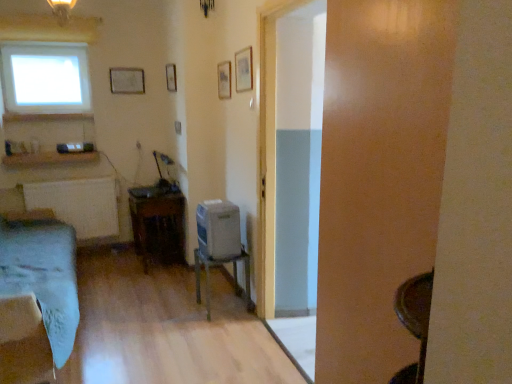
What is the approximate width of wooden table at center, which ranks as the second table in right-to-left order?

It is 17.06 inches.

Locate an element on the screen. white matte radiator at left is located at coordinates (78, 204).

This screenshot has height=384, width=512. Describe the element at coordinates (170, 77) in the screenshot. I see `wooden picture frame at upper center, the 3th picture frame in the right-to-left sequence` at that location.

Image resolution: width=512 pixels, height=384 pixels. What do you see at coordinates (244, 70) in the screenshot? I see `wooden picture frame at upper center, marked as the 4th picture frame in a back-to-front arrangement` at bounding box center [244, 70].

This screenshot has width=512, height=384. Identify the location of light blue fabric bed at left. (42, 276).

Locate an element on the screen. metallic gray table at center, which is the 1th table in right-to-left order is located at coordinates (233, 277).

Is transparent glass window at upper left turned away from satin silver desktop at center?

transparent glass window at upper left is not turned away from satin silver desktop at center.

From the image's perspective, between transparent glass window at upper left and satin silver desktop at center, which one is located above?

transparent glass window at upper left is shown above in the image.

From the picture: Considering the sizes of transparent glass window at upper left and satin silver desktop at center in the image, is transparent glass window at upper left taller or shorter than satin silver desktop at center?

In the image, transparent glass window at upper left appears to be taller than satin silver desktop at center.

Is transparent glass window at upper left with satin silver desktop at center?

No, transparent glass window at upper left is not touching satin silver desktop at center.

Which of these two, wooden table at center, which ranks as the second table in right-to-left order, or wooden picture frame at upper center, which ranks as the second picture frame in left-to-right order, is smaller?

Smaller between the two is wooden picture frame at upper center, which ranks as the second picture frame in left-to-right order.

From a real-world perspective, relative to wooden picture frame at upper center, the 3th picture frame in the front-to-back sequence, is wooden table at center, which ranks as the second table in right-to-left order, vertically above or below?

Clearly, from a real-world perspective, wooden table at center, which ranks as the second table in right-to-left order, is below wooden picture frame at upper center, the 3th picture frame in the front-to-back sequence.

Based on the photo, is wooden table at center, the 1th table from the back, closer to the viewer compared to wooden picture frame at upper center, the 3th picture frame in the front-to-back sequence?

Yes, wooden table at center, the 1th table from the back, is in front of wooden picture frame at upper center, the 3th picture frame in the front-to-back sequence.

You are a GUI agent. You are given a task and a screenshot of the screen. Output one action in this format:
    pyautogui.click(x=<x>, y=<y>)
    Task: Click on the radiator behind the matte wooden picture frame at upper center, marked as the second picture frame in a right-to-left arrangement
    This screenshot has height=384, width=512.
    Given the screenshot: What is the action you would take?
    pyautogui.click(x=78, y=204)

Which object is thinner, matte wooden picture frame at upper center, which appears as the third picture frame when viewed from the back, or white matte radiator at left?

Thinner between the two is matte wooden picture frame at upper center, which appears as the third picture frame when viewed from the back.

From a real-world perspective, is matte wooden picture frame at upper center, which appears as the third picture frame when viewed from the back, physically located above or below white matte radiator at left?

From a real-world perspective, matte wooden picture frame at upper center, which appears as the third picture frame when viewed from the back, is physically above white matte radiator at left.

Is matte wooden picture frame at upper center, marked as the second picture frame in a right-to-left arrangement, placed right next to white matte radiator at left?

They are not placed beside each other.

Locate an element on the screen. radiator above the light blue fabric bed at left (from the image's perspective) is located at coordinates (78, 204).

Considering the sizes of white matte radiator at left and light blue fabric bed at left in the image, is white matte radiator at left taller or shorter than light blue fabric bed at left?

white matte radiator at left is shorter than light blue fabric bed at left.

Is white matte radiator at left turned away from light blue fabric bed at left?

No, light blue fabric bed at left is not at the back of white matte radiator at left.

Considering the sizes of white matte radiator at left and light blue fabric bed at left in the image, is white matte radiator at left wider or thinner than light blue fabric bed at left?

In the image, white matte radiator at left appears to be more narrow than light blue fabric bed at left.

Between wooden table at center, which ranks as the second table in right-to-left order, and metallic gray table at center, which is the 1th table in right-to-left order, which one has larger width?

wooden table at center, which ranks as the second table in right-to-left order, is wider.

Is wooden table at center, marked as the first table in a left-to-right arrangement, positioned beyond the bounds of metallic gray table at center, arranged as the second table when viewed from the back?

Yes, wooden table at center, marked as the first table in a left-to-right arrangement, is located beyond the bounds of metallic gray table at center, arranged as the second table when viewed from the back.

Find the location of a particular element. The height and width of the screenshot is (384, 512). table on the right side of wooden table at center, the 1th table from the back is located at coordinates (233, 277).

Is wooden table at center, marked as the first table in a left-to-right arrangement, shorter than metallic gray table at center, which is the first table from front to back?

Incorrect, the height of wooden table at center, marked as the first table in a left-to-right arrangement, does not fall short of that of metallic gray table at center, which is the first table from front to back.

Is wooden picture frame at upper center, the 3th picture frame in the front-to-back sequence, looking in the opposite direction of white matte radiator at left?

No, wooden picture frame at upper center, the 3th picture frame in the front-to-back sequence, is not facing the opposite direction of white matte radiator at left.

From the image's perspective, count 3rd picture frames upward from the white matte radiator at left and point to it. Please provide its 2D coordinates.

[(170, 77)]

From the image's perspective, does wooden picture frame at upper center, which ranks as the second picture frame in left-to-right order, appear higher than white matte radiator at left?

Indeed, from the image's perspective, wooden picture frame at upper center, which ranks as the second picture frame in left-to-right order, is shown above white matte radiator at left.

Is transparent glass window at upper left bigger or smaller than wooden table at center, which ranks as the second table in right-to-left order?

In the image, transparent glass window at upper left appears to be smaller than wooden table at center, which ranks as the second table in right-to-left order.

What's the angular difference between transparent glass window at upper left and wooden table at center, the second table from the front,'s facing directions?

The angular difference between transparent glass window at upper left and wooden table at center, the second table from the front, is 89.5 degrees.

From a real-world perspective, which object stands above the other?

transparent glass window at upper left is physically above.

Is transparent glass window at upper left in front of or behind wooden table at center, the second table from the front, in the image?

In the image, transparent glass window at upper left appears behind wooden table at center, the second table from the front.

The height and width of the screenshot is (384, 512). Find the location of `window behind the satin silver desktop at center`. window behind the satin silver desktop at center is located at coordinates (45, 78).

Where is `the 1st picture frame counting from the right of the wooden table at center, which ranks as the second table in right-to-left order`? the 1st picture frame counting from the right of the wooden table at center, which ranks as the second table in right-to-left order is located at coordinates (170, 77).

Considering their positions, is metallic gray table at center, which is the 1th table in right-to-left order, positioned further to wooden picture frame at upper center, which ranks as the second picture frame in left-to-right order, than white matte radiator at left?

The object further to wooden picture frame at upper center, which ranks as the second picture frame in left-to-right order, is metallic gray table at center, which is the 1th table in right-to-left order.

Which object lies further to the anchor point metallic gray table at center, which is the 1th table in right-to-left order, wooden picture frame at upper center, the first picture frame when ordered from front to back, or transparent glass door at center?

Based on the image, wooden picture frame at upper center, the first picture frame when ordered from front to back, appears to be further to metallic gray table at center, which is the 1th table in right-to-left order.

Which object lies nearer to the anchor point transparent glass window at upper left, satin silver desktop at center or wooden picture frame at upper center, the 3th picture frame in the front-to-back sequence?

wooden picture frame at upper center, the 3th picture frame in the front-to-back sequence, is closer to transparent glass window at upper left.

Based on their spatial positions, is wooden picture frame at upper center, which ranks as the second picture frame in left-to-right order, or matte white picture frame at upper center, acting as the 4th picture frame starting from the right, closer to transparent glass window at upper left?

matte white picture frame at upper center, acting as the 4th picture frame starting from the right, lies closer to transparent glass window at upper left than the other object.

From the picture: When comparing their distances from matte wooden picture frame at upper center, positioned as the third picture frame in left-to-right order, does transparent glass window at upper left or wooden table at center, which ranks as the second table in right-to-left order, seem further?

transparent glass window at upper left.

When comparing their distances from white matte radiator at left, does wooden picture frame at upper center, the 3th picture frame in the right-to-left sequence, or metallic gray table at center, which is the 1th table in right-to-left order, seem further?

metallic gray table at center, which is the 1th table in right-to-left order, is positioned further to the anchor white matte radiator at left.

From the picture: Based on their spatial positions, is matte wooden picture frame at upper center, which appears as the third picture frame when viewed from the back, or white matte radiator at left further from wooden table at center, marked as the first table in a left-to-right arrangement?

Among the two, matte wooden picture frame at upper center, which appears as the third picture frame when viewed from the back, is located further to wooden table at center, marked as the first table in a left-to-right arrangement.

Considering their positions, is wooden picture frame at upper center, the 3th picture frame in the right-to-left sequence, positioned closer to light blue fabric bed at left than transparent glass door at center?

transparent glass door at center.

Where is `radiator between transparent glass door at center and matte white picture frame at upper center, the first picture frame when ordered from left to right, from front to back`? radiator between transparent glass door at center and matte white picture frame at upper center, the first picture frame when ordered from left to right, from front to back is located at coordinates (78, 204).

Identify the location of glass door between light blue fabric bed at left and white matte radiator at left from front to back. (292, 174).

At what (x,y) coordinates should I click in order to perform the action: click on desktop computer between transparent glass door at center and wooden table at center, which ranks as the second table in right-to-left order, along the z-axis. Please return your answer as a coordinate pair (x, y). This screenshot has width=512, height=384. Looking at the image, I should click on click(x=218, y=229).

This screenshot has width=512, height=384. I want to click on desktop computer between matte white picture frame at upper center, acting as the 4th picture frame starting from the right, and wooden table at center, which ranks as the second table in right-to-left order, from top to bottom, so click(218, 229).